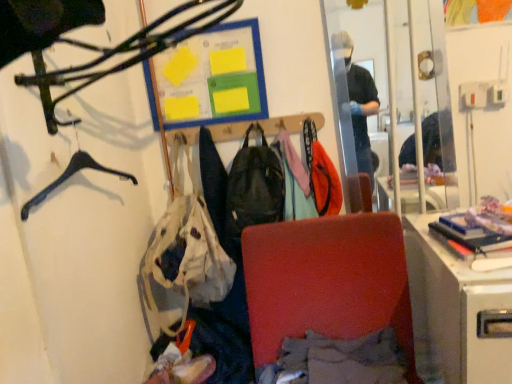
Question: Is clear glass mirror at upper right to the left of matte black hanger at upper left from the viewer's perspective?

Choices:
 (A) yes
 (B) no

Answer: (B)

Question: Is clear glass mirror at upper right outside matte black hanger at upper left?

Choices:
 (A) no
 (B) yes

Answer: (B)

Question: Is clear glass mirror at upper right in contact with matte black hanger at upper left?

Choices:
 (A) yes
 (B) no

Answer: (B)

Question: Is clear glass mirror at upper right thinner than matte black hanger at upper left?

Choices:
 (A) yes
 (B) no

Answer: (A)

Question: From a real-world perspective, is clear glass mirror at upper right on top of matte black hanger at upper left?

Choices:
 (A) no
 (B) yes

Answer: (A)

Question: Is white fabric handbag at center taller or shorter than matte black hanger at upper left?

Choices:
 (A) tall
 (B) short

Answer: (A)

Question: Considering the relative positions of white fabric handbag at center and matte black hanger at upper left in the image provided, is white fabric handbag at center to the left or to the right of matte black hanger at upper left?

Choices:
 (A) right
 (B) left

Answer: (A)

Question: Considering the positions of point (181, 291) and point (125, 66), is point (181, 291) closer or farther from the camera than point (125, 66)?

Choices:
 (A) farther
 (B) closer

Answer: (A)

Question: Is white fabric handbag at center inside the boundaries of matte black hanger at upper left, or outside?

Choices:
 (A) inside
 (B) outside

Answer: (B)

Question: From a real-world perspective, is velvet red chair at center physically located above or below hardcover book at right?

Choices:
 (A) above
 (B) below

Answer: (B)

Question: Is velvet red chair at center taller or shorter than hardcover book at right?

Choices:
 (A) short
 (B) tall

Answer: (B)

Question: Relative to hardcover book at right, is velvet red chair at center in front or behind?

Choices:
 (A) front
 (B) behind

Answer: (A)

Question: Is velvet red chair at center inside the boundaries of hardcover book at right, or outside?

Choices:
 (A) outside
 (B) inside

Answer: (A)

Question: Is white fabric handbag at center wider or thinner than clear glass mirror at upper right?

Choices:
 (A) thin
 (B) wide

Answer: (B)

Question: In the image, is white fabric handbag at center positioned in front of or behind clear glass mirror at upper right?

Choices:
 (A) front
 (B) behind

Answer: (A)